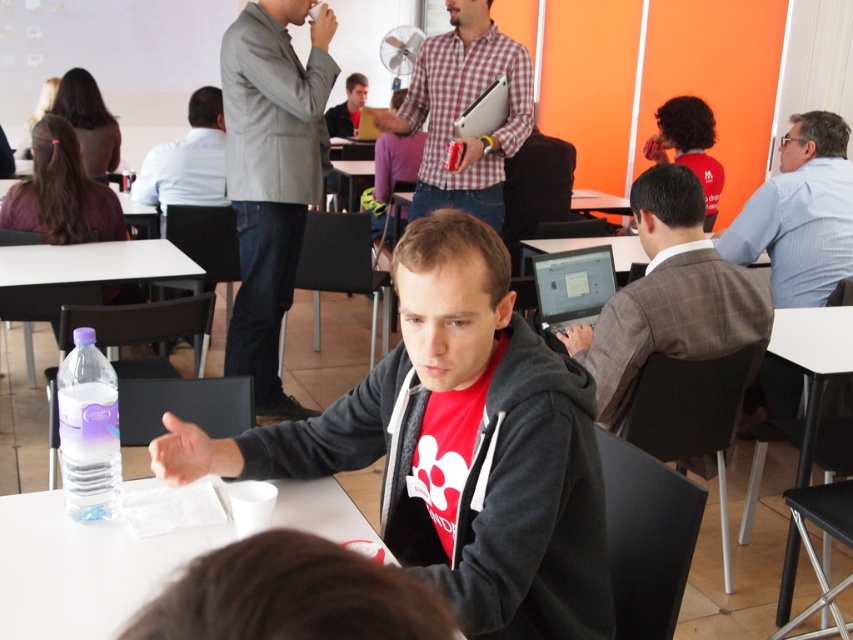
Question: Which is nearer to the dark gray hoodie at center?

Choices:
 (A) white plastic table at lower right
 (B) blue striped shirt at right
 (C) white plastic table at lower center
 (D) brown plaid blazer at center

Answer: (C)

Question: Can you confirm if brown plaid blazer at center is bigger than white plastic table at center?

Choices:
 (A) no
 (B) yes

Answer: (A)

Question: Is light gray blazer at upper left to the right of matte black laptop at center from the viewer's perspective?

Choices:
 (A) no
 (B) yes

Answer: (A)

Question: Among these points, which one is nearest to the camera?

Choices:
 (A) (61, 248)
 (B) (345, 173)

Answer: (A)

Question: Which object is positioned closest to the white plastic table at lower center?

Choices:
 (A) light blue shirt at upper left
 (B) white plastic table at center
 (C) white plastic table at lower right

Answer: (C)

Question: Can you confirm if blue striped shirt at right is positioned to the left of light blue shirt at upper left?

Choices:
 (A) yes
 (B) no

Answer: (B)